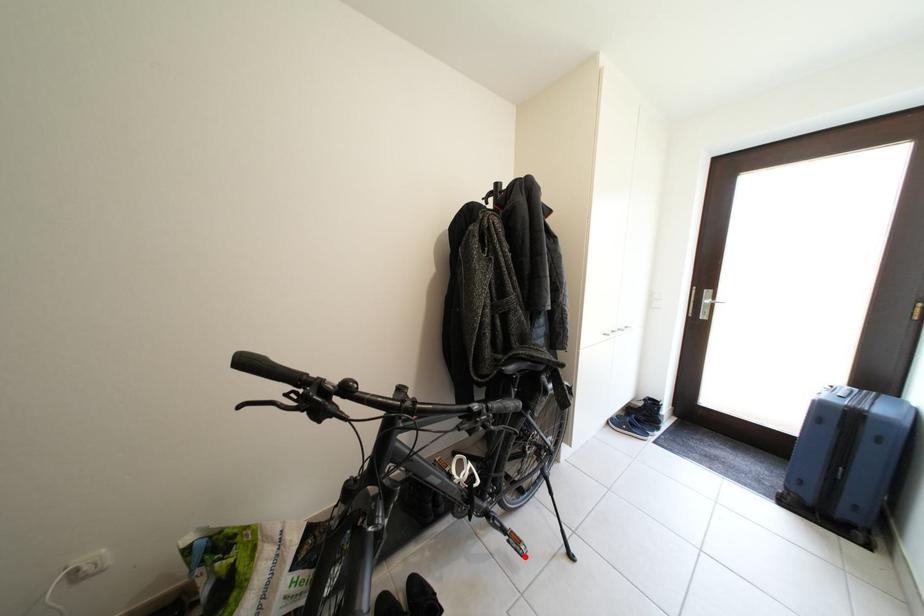
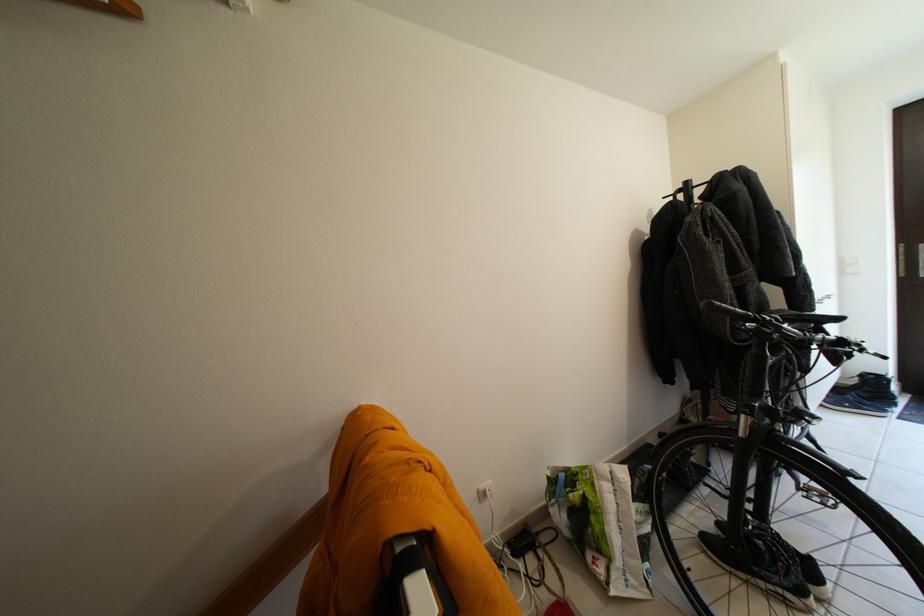
In the second image, find the point that corresponds to the highlighted location in the first image.

(832, 509)